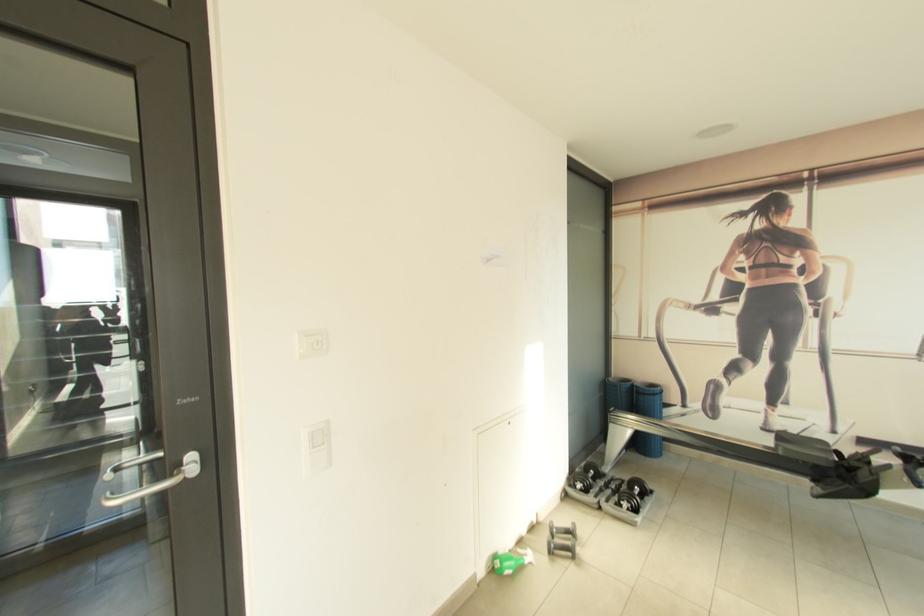
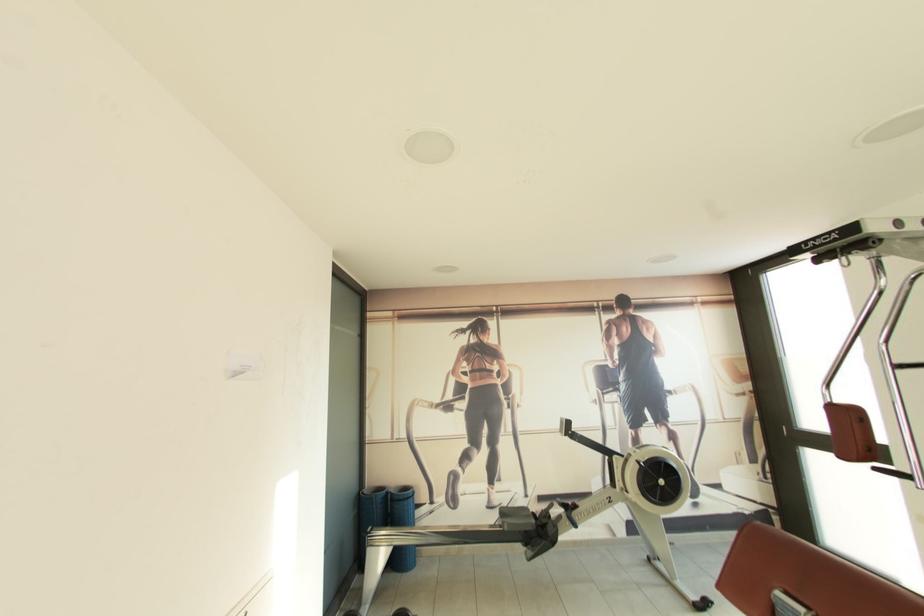
In the second image, find the point that corresponds to (615,381) in the first image.

(371, 493)